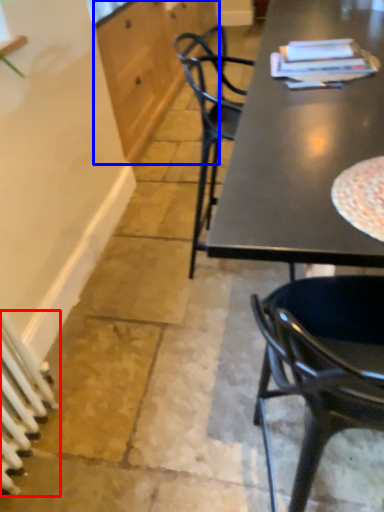
Question: Which object is closer to the camera taking this photo, radiator (highlighted by a red box) or cabinetry (highlighted by a blue box)?

Choices:
 (A) radiator
 (B) cabinetry

Answer: (A)